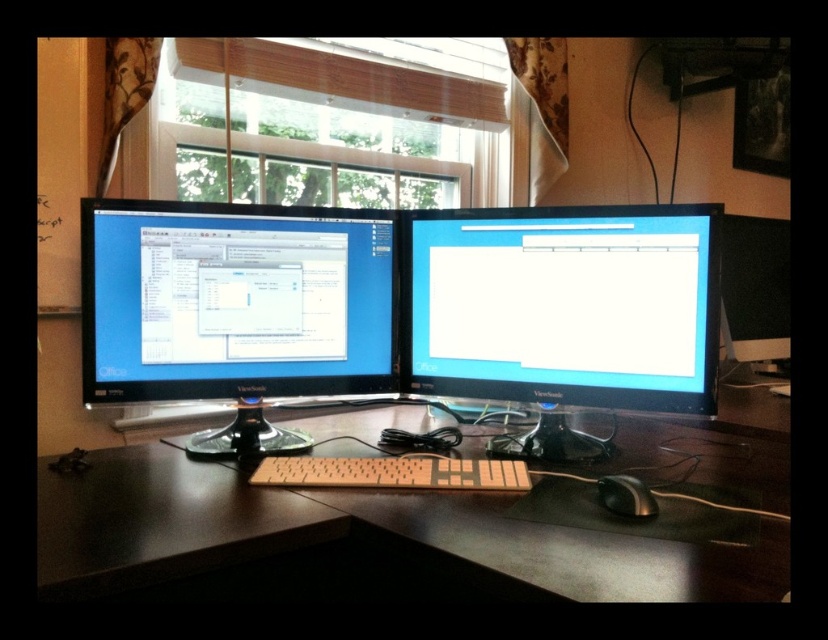
You are setting up a dual monitor workspace and need to place a 10.5 inch wide laptop between the two monitors. Can the laptop fit exactly between the satin black monitor at center and the matte black monitor at center?

The distance between the satin black monitor at center and the matte black monitor at center is 10.55 inches, so the 10.5 inch wide laptop can fit exactly between them with a small amount of space remaining.

You are navigating a robotic arm to pick up an object from the desk. The robotic arm can only move in a straight line from its current position at point A to point B. If point A is at coordinates point (607,321) and point B is at coordinates point (624,477), will the robotic arm pass over any objects between these two points?

The robotic arm will not pass over any objects between point (607,321) and point (624,477) because the path between them is clear.

Based on the photo, you are setting up a dual monitor workspace and need to place a 15 cm tall document holder between the two monitors. Given the height difference between the satin black monitor at center and the matte black monitor at center, will the document holder fit snugly between them without tilting?

The satin black monitor at center is much taller than the matte black monitor at center. Since the document holder is 15 cm tall, it may not fit snugly between them due to the height difference, potentially causing it to tilt unless adjusted properly.